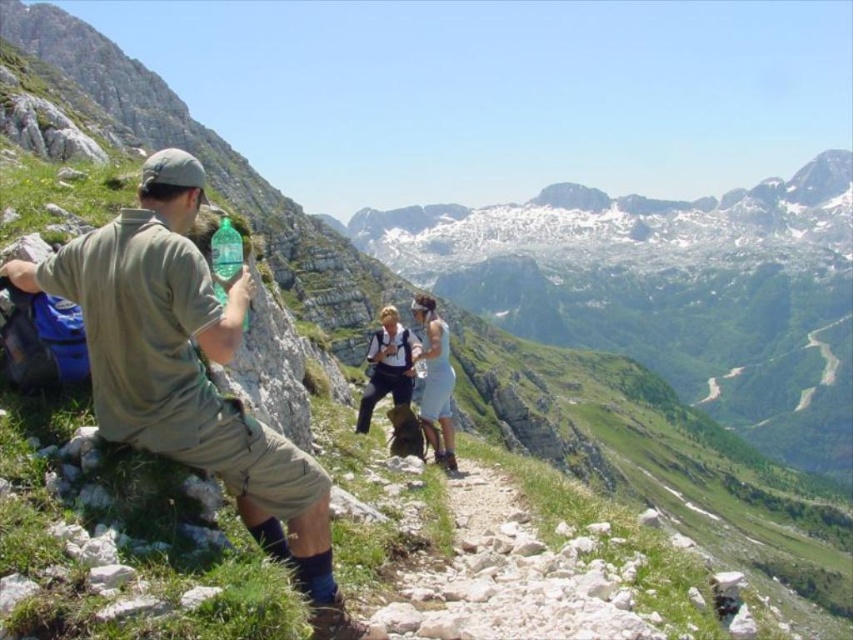
Is matte green t-shirt at left bigger than white fabric backpack at center?

Yes, matte green t-shirt at left is bigger than white fabric backpack at center.

Between matte green t-shirt at left and white fabric backpack at center, which one is positioned lower?

white fabric backpack at center is lower down.

Identify the location of matte green t-shirt at left. (190, 372).

Is light blue fabric dress at center bigger than white fabric backpack at center?

Yes.

Is light blue fabric dress at center wider than white fabric backpack at center?

In fact, light blue fabric dress at center might be narrower than white fabric backpack at center.

What are the coordinates of `light blue fabric dress at center` in the screenshot? It's located at (434, 381).

Where is `light blue fabric dress at center`? light blue fabric dress at center is located at coordinates (434, 381).

Measure the distance between point (38, 264) and camera.

32.22 meters

The height and width of the screenshot is (640, 853). I want to click on matte green t-shirt at left, so 190,372.

Where is `matte green t-shirt at left`? Image resolution: width=853 pixels, height=640 pixels. matte green t-shirt at left is located at coordinates (190, 372).